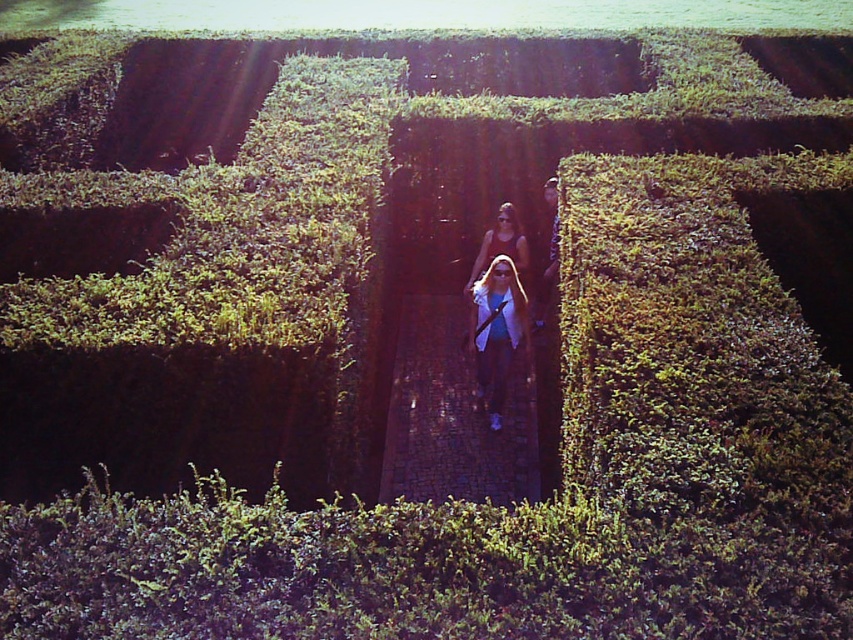
You are a drone operator tasked with capturing aerial footage of the maze. Your camera has a minimum focus distance of 36 inches. Can you focus on both the matte white jacket at center and the matte black tank top at center simultaneously?

The matte white jacket at center is 37.33 inches away from the matte black tank top at center, which is just beyond the camera minimum focus distance of 36 inches. Therefore, the drone operator cannot focus on both simultaneously.

You are navigating a hedge maze and come across a matte white jacket at center. If you walk straight ahead from the jacket, which direction will lead you out of the maze?

The direction to walk straight ahead from the matte white jacket at center is north, as the maze exits are typically located north of the central point.